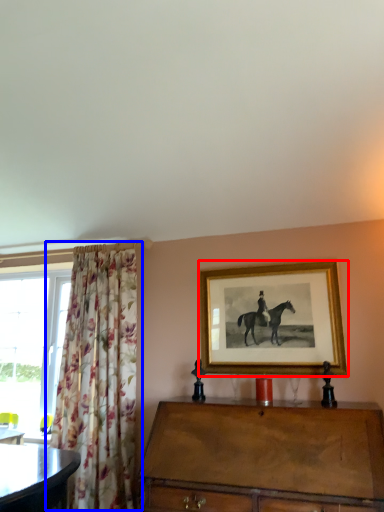
Question: Which point is closer to the camera, picture frame (highlighted by a red box) or curtain (highlighted by a blue box)?

Choices:
 (A) picture frame
 (B) curtain

Answer: (B)